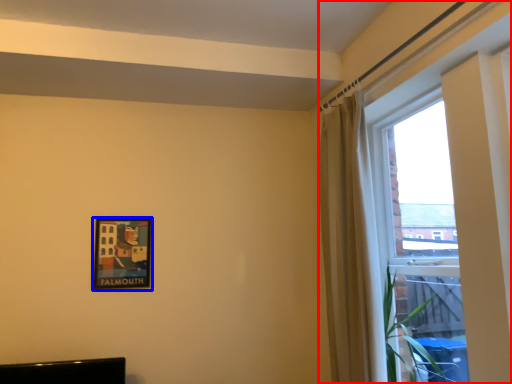
Question: Which of the following is the closest to the observer, window (highlighted by a red box) or picture frame (highlighted by a blue box)?

Choices:
 (A) window
 (B) picture frame

Answer: (A)